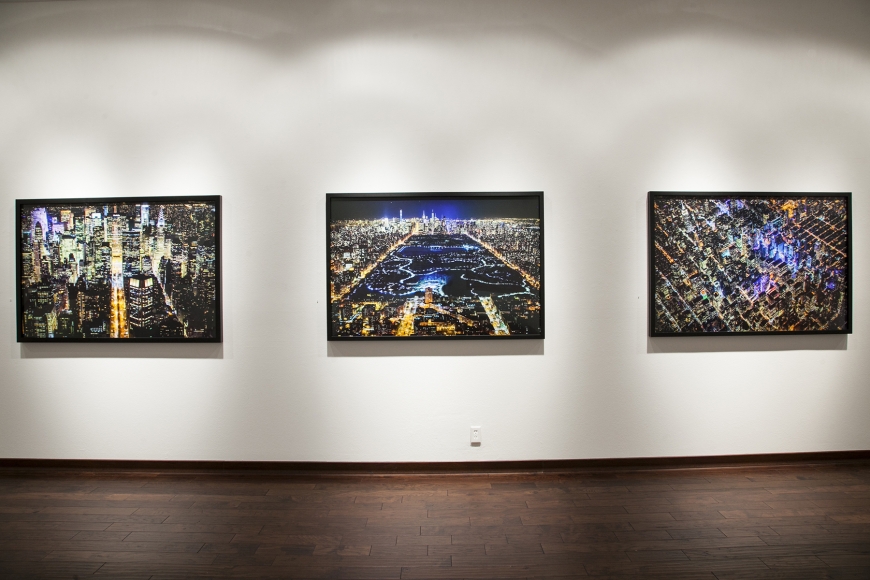
Where is `middle painting`? The height and width of the screenshot is (580, 870). middle painting is located at coordinates (452, 288).